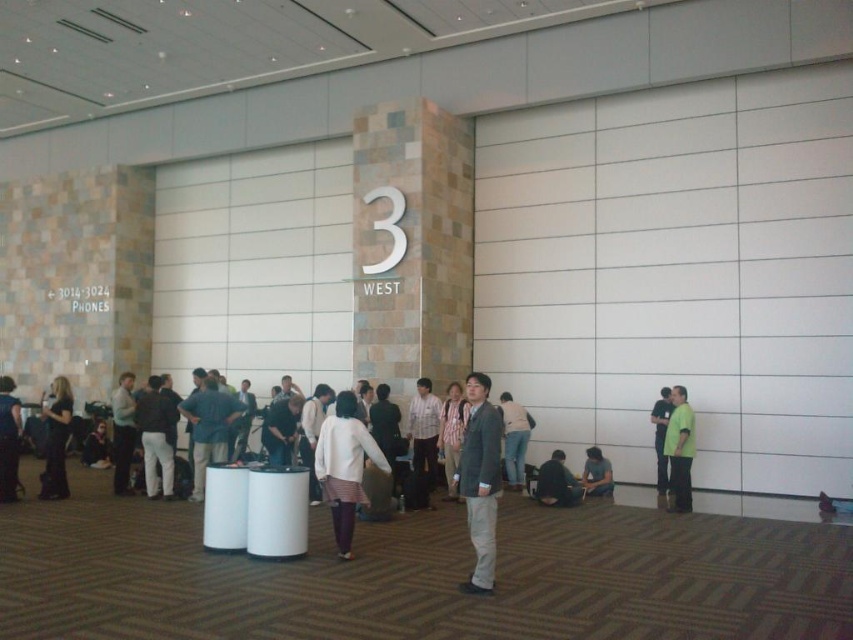
Who is more distant from viewer, (128, 403) or (596, 474)?

Point (596, 474)

The image size is (853, 640). What do you see at coordinates (122, 432) in the screenshot?
I see `light gray shirt at center` at bounding box center [122, 432].

You are a GUI agent. You are given a task and a screenshot of the screen. Output one action in this format:
    pyautogui.click(x=<x>, y=<y>)
    Task: Click on the light gray shirt at center
    
    Given the screenshot: What is the action you would take?
    pyautogui.click(x=122, y=432)

Can you confirm if dark gray fabric jacket at lower center is wider than matte black jacket at lower left?

No.

This screenshot has width=853, height=640. I want to click on dark gray fabric jacket at lower center, so click(x=556, y=483).

At what (x,y) coordinates should I click in order to perform the action: click on dark gray fabric jacket at lower center. Please return your answer as a coordinate pair (x, y). Looking at the image, I should click on (556, 483).

Locate an element on the screen. Image resolution: width=853 pixels, height=640 pixels. black fabric dress at left is located at coordinates (56, 440).

Measure the distance from black fabric dress at left to light gray shirt at center.

They are 1.18 meters apart.

Between point (57, 481) and point (125, 486), which one is positioned in front?

Point (57, 481)

Locate an element on the screen. Image resolution: width=853 pixels, height=640 pixels. black fabric dress at left is located at coordinates (56, 440).